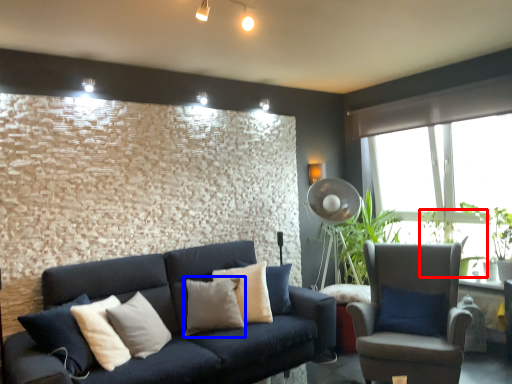
Question: Among these objects, which one is nearest to the camera, plant (highlighted by a red box) or pillow (highlighted by a blue box)?

Choices:
 (A) plant
 (B) pillow

Answer: (B)